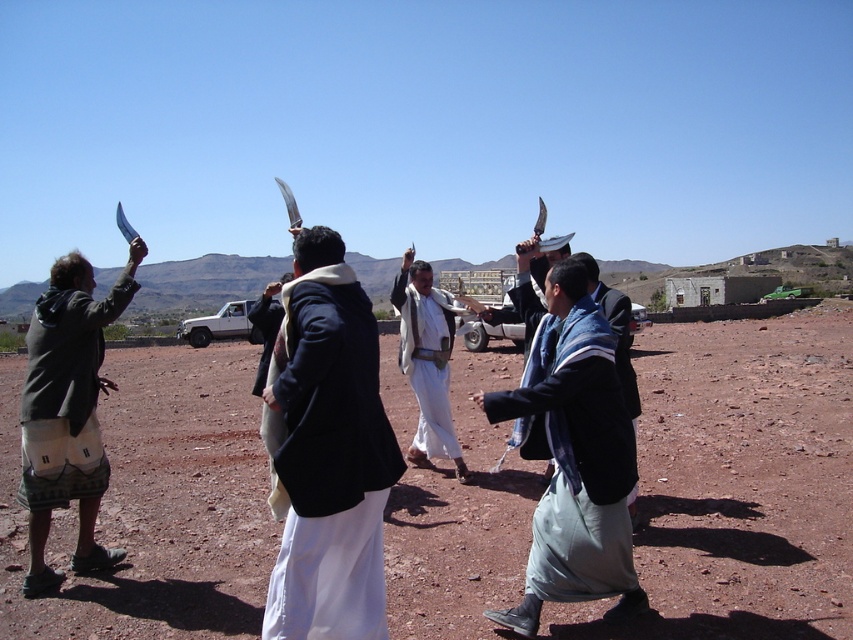
Question: Does green woven cloth at left appear under white matte robe at center?

Choices:
 (A) yes
 (B) no

Answer: (A)

Question: Can you confirm if dark blue woolen robe at center is wider than white matte robe at center?

Choices:
 (A) no
 (B) yes

Answer: (A)

Question: Which of the following is the closest to the observer?

Choices:
 (A) green woven cloth at left
 (B) light blue fabric at center
 (C) white matte robe at center
 (D) white woolen robe at center

Answer: (D)

Question: Estimate the real-world distances between objects in this image. Which object is closer to the green woven cloth at left?

Choices:
 (A) dark blue woolen robe at center
 (B) light blue fabric at center
 (C) white woolen robe at center

Answer: (A)

Question: Can you confirm if dirt field at center is smaller than white matte robe at center?

Choices:
 (A) no
 (B) yes

Answer: (A)

Question: Based on their relative distances, which object is farther from the dirt field at center?

Choices:
 (A) white matte robe at center
 (B) green woven cloth at left
 (C) white woolen robe at center
 (D) dark blue woolen robe at center

Answer: (B)